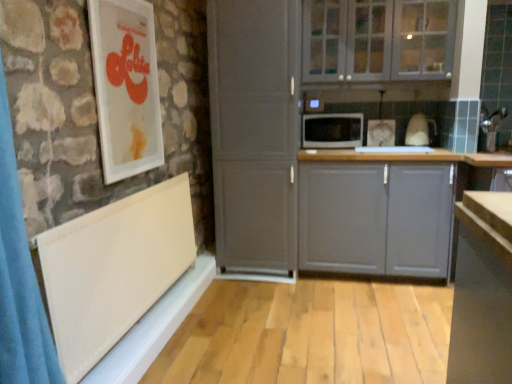
Image resolution: width=512 pixels, height=384 pixels. Find the location of `empty space that is in between white matte cabinet at center and white textured window sill at lower left`. empty space that is in between white matte cabinet at center and white textured window sill at lower left is located at coordinates (221, 318).